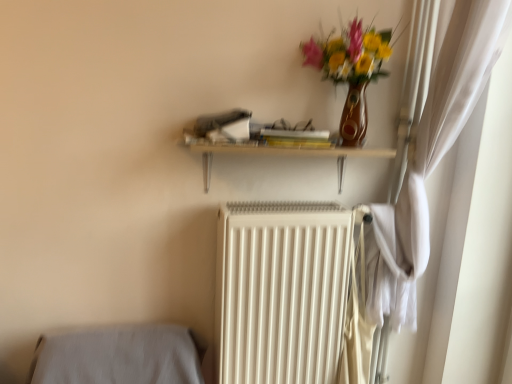
Question: Does white matte radiator at center have a smaller size compared to matte brown vase with flowers at upper right?

Choices:
 (A) yes
 (B) no

Answer: (B)

Question: Is white matte radiator at center not within matte brown vase with flowers at upper right?

Choices:
 (A) yes
 (B) no

Answer: (A)

Question: Can you confirm if white matte radiator at center is thinner than matte brown vase with flowers at upper right?

Choices:
 (A) yes
 (B) no

Answer: (A)

Question: Is white matte radiator at center shorter than matte brown vase with flowers at upper right?

Choices:
 (A) no
 (B) yes

Answer: (A)

Question: Does white matte radiator at center contain matte brown vase with flowers at upper right?

Choices:
 (A) yes
 (B) no

Answer: (B)

Question: From a real-world perspective, is white matte radiator at center under matte brown vase with flowers at upper right?

Choices:
 (A) yes
 (B) no

Answer: (A)

Question: Is white matte radiator at center directly adjacent to wooden shelf at upper center?

Choices:
 (A) no
 (B) yes

Answer: (A)

Question: Is white matte radiator at center aimed at wooden shelf at upper center?

Choices:
 (A) no
 (B) yes

Answer: (A)

Question: From the image's perspective, is white matte radiator at center located above wooden shelf at upper center?

Choices:
 (A) no
 (B) yes

Answer: (A)

Question: From the image's perspective, is white matte radiator at center located beneath wooden shelf at upper center?

Choices:
 (A) no
 (B) yes

Answer: (B)

Question: Is wooden shelf at upper center at the back of white matte radiator at center?

Choices:
 (A) no
 (B) yes

Answer: (A)

Question: Does white matte radiator at center have a lesser width compared to wooden shelf at upper center?

Choices:
 (A) no
 (B) yes

Answer: (A)

Question: From a real-world perspective, does wooden shelf at upper center stand above white matte radiator at center?

Choices:
 (A) no
 (B) yes

Answer: (B)